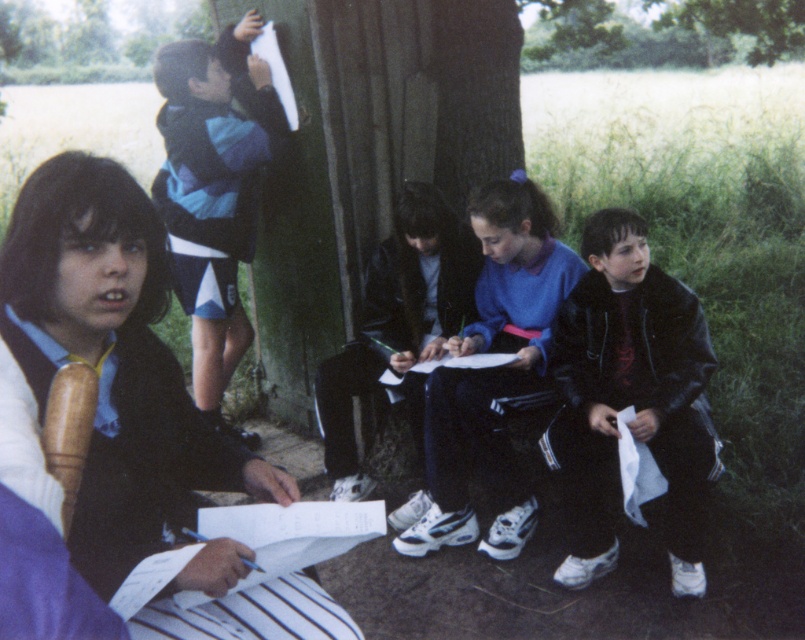
Does matte black vest at lower left appear on the right side of green leafy tree at upper center?

No, matte black vest at lower left is not to the right of green leafy tree at upper center.

Identify the location of matte black vest at lower left. (137, 410).

Identify the location of matte black vest at lower left. (137, 410).

Does green leafy tree at upper center appear under green leafy tree at upper left?

Correct, green leafy tree at upper center is located below green leafy tree at upper left.

Between green leafy tree at upper center and green leafy tree at upper left, which one appears on the right side from the viewer's perspective?

Positioned to the right is green leafy tree at upper center.

Who is more forward, [696,49] or [3,65]?

Point [696,49] is more forward.

Locate an element on the screen. Image resolution: width=805 pixels, height=640 pixels. green leafy tree at upper center is located at coordinates click(663, 33).

Can you confirm if blue fleece jacket at center is thinner than dark blue jacket at center?

No, blue fleece jacket at center is not thinner than dark blue jacket at center.

Does blue fleece jacket at center appear under dark blue jacket at center?

Indeed, blue fleece jacket at center is positioned under dark blue jacket at center.

The width and height of the screenshot is (805, 640). What are the coordinates of `blue fleece jacket at center` in the screenshot? It's located at (490, 372).